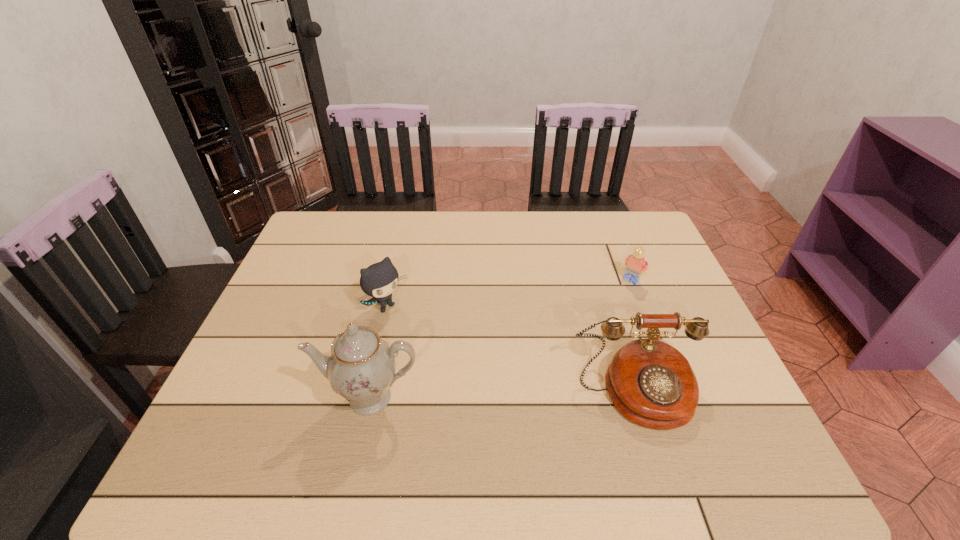
You are a GUI agent. You are given a task and a screenshot of the screen. Output one action in this format:
    pyautogui.click(x=<x>, y=<y>)
    Task: Click on the free space on the desktop that is between the tallest object and the second tallest object and is positioned on the front-facing side of the kitten
    
    Given the screenshot: What is the action you would take?
    pyautogui.click(x=475, y=395)

The width and height of the screenshot is (960, 540). I want to click on vacant space on the desktop that is between the tallest object and the third shortest object and is positioned on the front-facing side of the shortest object, so click(x=533, y=394).